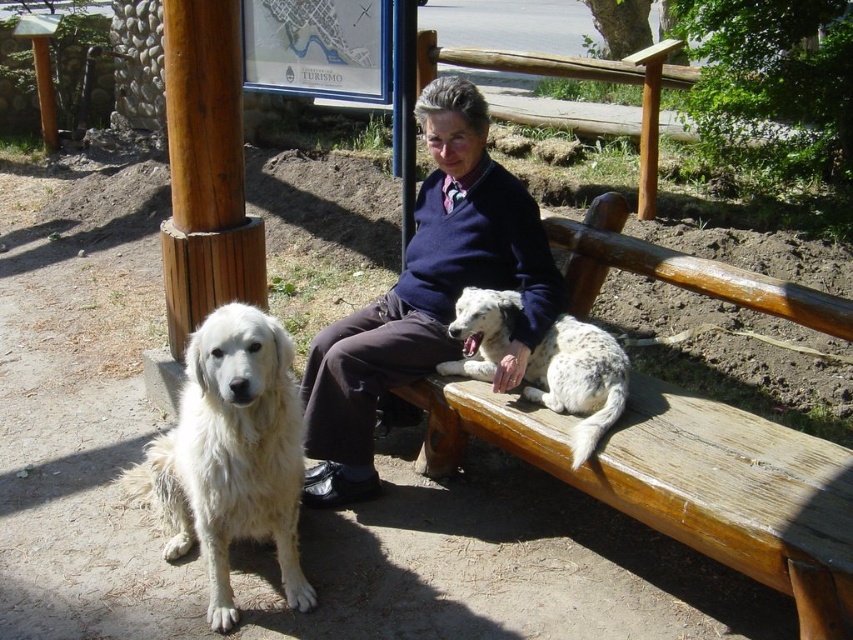
You are a photographer trying to capture a closeup of the dark blue sweater at center and the spotted fur dog at bench center. If your camera can only focus on one subject at a time, which subject should you choose to ensure the entire width of the subject fits in the frame?

The dark blue sweater at center might be wider than spotted fur dog at bench center, so you should focus on the dark blue sweater at center to ensure the entire width fits in the frame.

From the picture: What is the exact position of the dark blue sweater at center in the image?

The dark blue sweater at center is located at point coordinates of 0.464 in the x axis and 0.502 in the y axis.

You are standing at the camera position and want to throw a ball to a spot that is exactly 9 feet away. Is the point at coordinates point (x=682, y=397) within the target range?

The point point (x=682, y=397) is 8.77 feet away from the camera, so it is within the target range of 9 feet.